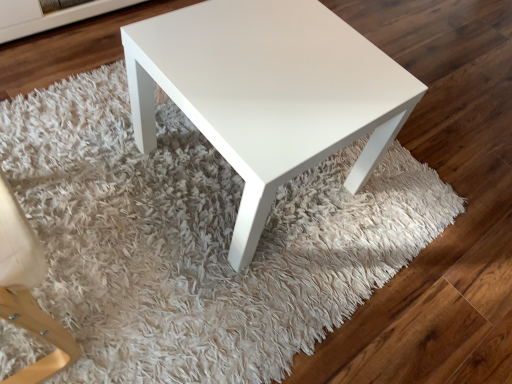
Find the location of a particular element. vacant area situated to the left side of white glossy table at center is located at coordinates (87, 157).